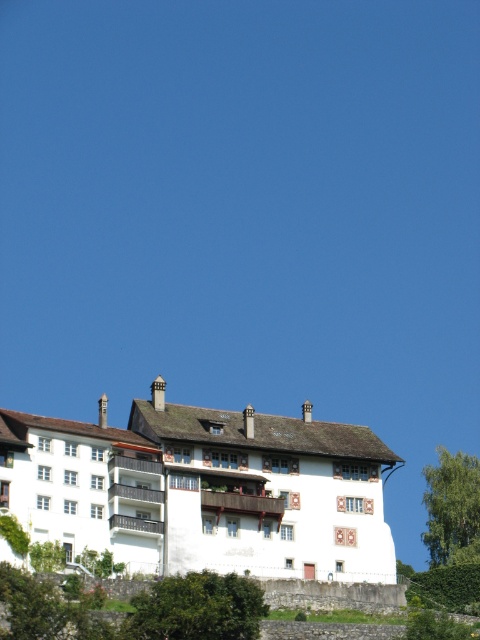
Question: Can you confirm if green leafy tree at lower center is positioned to the left of green leafy tree at lower right?

Choices:
 (A) yes
 (B) no

Answer: (A)

Question: Among these objects, which one is nearest to the camera?

Choices:
 (A) green leafy tree at lower right
 (B) green leafy tree at lower center

Answer: (B)

Question: In this image, where is green leafy tree at lower center located relative to green leafy tree at lower right?

Choices:
 (A) right
 (B) left

Answer: (B)

Question: Does green leafy tree at lower center have a smaller size compared to green leafy tree at lower right?

Choices:
 (A) yes
 (B) no

Answer: (A)